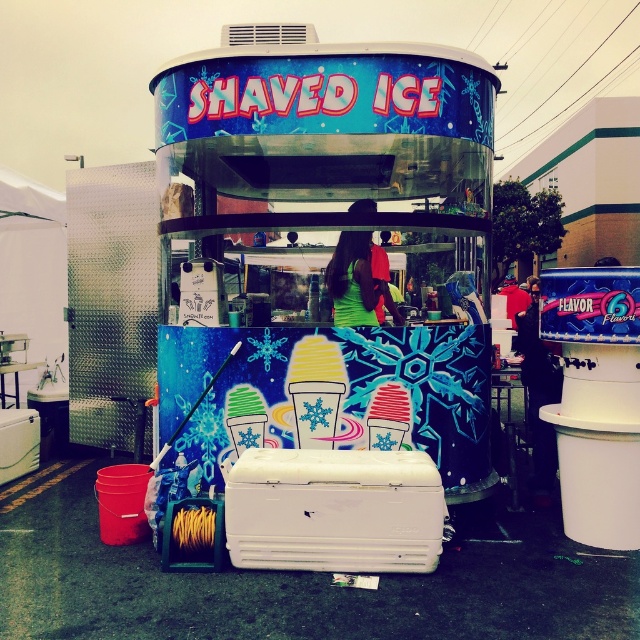
Question: Does white plastic cooler at center appear on the left side of green matte shirt at center?

Choices:
 (A) yes
 (B) no

Answer: (A)

Question: Which point appears farthest from the camera in this image?

Choices:
 (A) (381, 419)
 (B) (364, 276)

Answer: (B)

Question: Is shiny metallic shaved ice cart at center closer to camera compared to green matte shirt at center?

Choices:
 (A) no
 (B) yes

Answer: (B)

Question: Is white plastic cooler at center bigger than green matte shirt at center?

Choices:
 (A) yes
 (B) no

Answer: (B)

Question: Which point is farther from the camera taking this photo?

Choices:
 (A) (378, 417)
 (B) (317, 506)

Answer: (A)

Question: Among these points, which one is farthest from the camera?

Choices:
 (A) (330, 474)
 (B) (364, 240)
 (C) (451, 426)

Answer: (B)